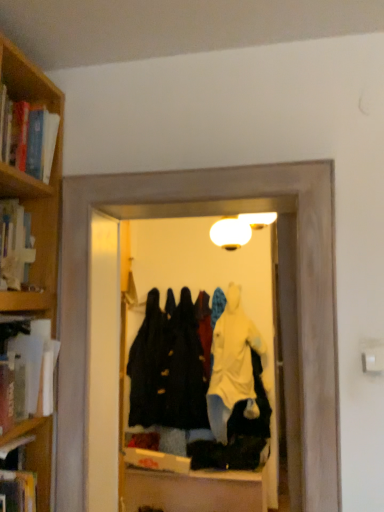
Question: Does black matte coat at center have a lesser height compared to wooden bookshelf at upper left, which is the fourth book from bottom to top?

Choices:
 (A) no
 (B) yes

Answer: (A)

Question: Is black matte coat at center outside of wooden bookshelf at upper left, which is the fourth book from bottom to top?

Choices:
 (A) yes
 (B) no

Answer: (A)

Question: Considering the relative positions of black matte coat at center and wooden bookshelf at upper left, which is the fourth book from bottom to top, in the image provided, is black matte coat at center to the right of wooden bookshelf at upper left, which is the fourth book from bottom to top, from the viewer's perspective?

Choices:
 (A) no
 (B) yes

Answer: (B)

Question: Does black matte coat at center have a lesser width compared to wooden bookshelf at upper left, the 1th book viewed from the top?

Choices:
 (A) no
 (B) yes

Answer: (B)

Question: Does black matte coat at center have a greater width compared to wooden bookshelf at upper left, which is the fourth book from bottom to top?

Choices:
 (A) no
 (B) yes

Answer: (A)

Question: From the image's perspective, is light yellow cotton bathrobe at center above or below hardcover book at left, the third book viewed from the top?

Choices:
 (A) below
 (B) above

Answer: (A)

Question: Is light yellow cotton bathrobe at center in front of or behind hardcover book at left, marked as the second book in a bottom-to-top arrangement, in the image?

Choices:
 (A) behind
 (B) front

Answer: (A)

Question: Is point (221, 386) closer or farther from the camera than point (51, 360)?

Choices:
 (A) farther
 (B) closer

Answer: (A)

Question: In the image, is light yellow cotton bathrobe at center on the left side or the right side of hardcover book at left, marked as the second book in a bottom-to-top arrangement?

Choices:
 (A) right
 (B) left

Answer: (A)

Question: Is wooden bookshelf at upper left, which is the fourth book from bottom to top, bigger or smaller than transparent plastic coat rack at center?

Choices:
 (A) big
 (B) small

Answer: (B)

Question: Is wooden bookshelf at upper left, the 1th book viewed from the top, in front of or behind transparent plastic coat rack at center in the image?

Choices:
 (A) behind
 (B) front

Answer: (B)

Question: Would you say wooden bookshelf at upper left, the 1th book viewed from the top, is to the left or to the right of transparent plastic coat rack at center in the picture?

Choices:
 (A) left
 (B) right

Answer: (A)

Question: From a real-world perspective, is wooden bookshelf at upper left, which is the fourth book from bottom to top, positioned above or below transparent plastic coat rack at center?

Choices:
 (A) below
 (B) above

Answer: (B)

Question: Visually, is hardcover book at left, acting as the 4th book starting from the top, positioned to the left or to the right of black matte coat at center?

Choices:
 (A) left
 (B) right

Answer: (A)

Question: Considering their positions, is hardcover book at left, acting as the 4th book starting from the top, located in front of or behind black matte coat at center?

Choices:
 (A) behind
 (B) front

Answer: (B)